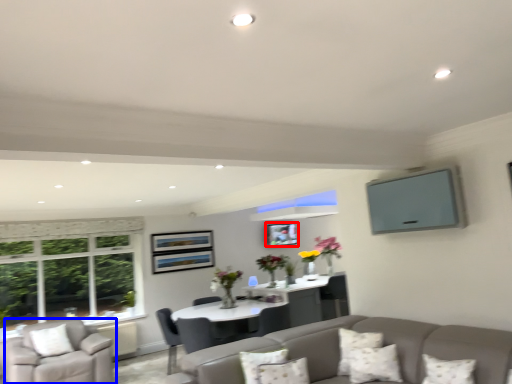
Question: Which point is closer to the camera, picture frame (highlighted by a red box) or chair (highlighted by a blue box)?

Choices:
 (A) picture frame
 (B) chair

Answer: (B)